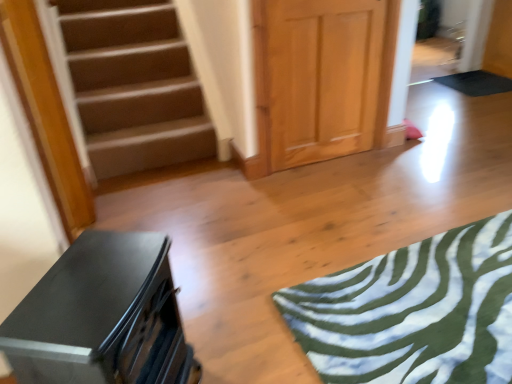
Question: From the image's perspective, does light wood paneling at center appear lower than green fabric yoga mat at lower right, marked as the second yoga mat in a right-to-left arrangement?

Choices:
 (A) yes
 (B) no

Answer: (B)

Question: Is light wood paneling at center in contact with green fabric yoga mat at lower right, the 1th yoga mat from the front?

Choices:
 (A) yes
 (B) no

Answer: (B)

Question: Is green fabric yoga mat at lower right, which is the second yoga mat in back-to-front order, inside light wood paneling at center?

Choices:
 (A) no
 (B) yes

Answer: (A)

Question: Can you confirm if light wood paneling at center is bigger than green fabric yoga mat at lower right, marked as the second yoga mat in a right-to-left arrangement?

Choices:
 (A) no
 (B) yes

Answer: (B)

Question: Is light wood paneling at center aimed at green fabric yoga mat at lower right, marked as the second yoga mat in a right-to-left arrangement?

Choices:
 (A) no
 (B) yes

Answer: (B)

Question: Is light wood paneling at center inside the boundaries of matte black dresser at lower left, or outside?

Choices:
 (A) inside
 (B) outside

Answer: (B)

Question: Visually, is light wood paneling at center positioned to the left or to the right of matte black dresser at lower left?

Choices:
 (A) left
 (B) right

Answer: (B)

Question: From a real-world perspective, relative to matte black dresser at lower left, is light wood paneling at center vertically above or below?

Choices:
 (A) below
 (B) above

Answer: (B)

Question: Considering their positions, is light wood paneling at center located in front of or behind matte black dresser at lower left?

Choices:
 (A) front
 (B) behind

Answer: (B)

Question: Is matte black dresser at lower left in front of or behind light wood paneling at center in the image?

Choices:
 (A) front
 (B) behind

Answer: (A)

Question: From a real-world perspective, is matte black dresser at lower left physically located above or below light wood paneling at center?

Choices:
 (A) above
 (B) below

Answer: (B)

Question: From their relative heights in the image, would you say matte black dresser at lower left is taller or shorter than light wood paneling at center?

Choices:
 (A) short
 (B) tall

Answer: (A)

Question: Is matte black dresser at lower left bigger or smaller than light wood paneling at center?

Choices:
 (A) small
 (B) big

Answer: (B)

Question: Is green fabric yoga mat at lower right, which is the second yoga mat in back-to-front order, inside or outside of matte black dresser at lower left?

Choices:
 (A) outside
 (B) inside

Answer: (A)

Question: Considering the positions of green fabric yoga mat at lower right, which is the second yoga mat in back-to-front order, and matte black dresser at lower left in the image, is green fabric yoga mat at lower right, which is the second yoga mat in back-to-front order, wider or thinner than matte black dresser at lower left?

Choices:
 (A) thin
 (B) wide

Answer: (B)